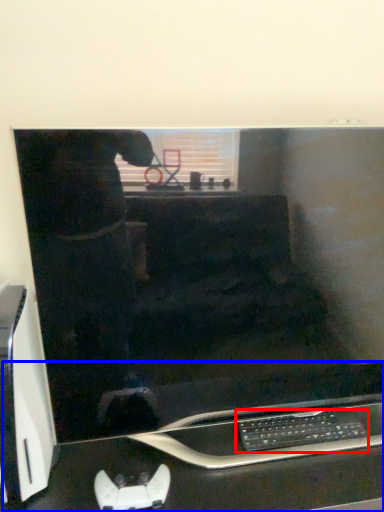
Question: Among these objects, which one is nearest to the camera, computer keyboard (highlighted by a red box) or computer desk (highlighted by a blue box)?

Choices:
 (A) computer keyboard
 (B) computer desk

Answer: (B)